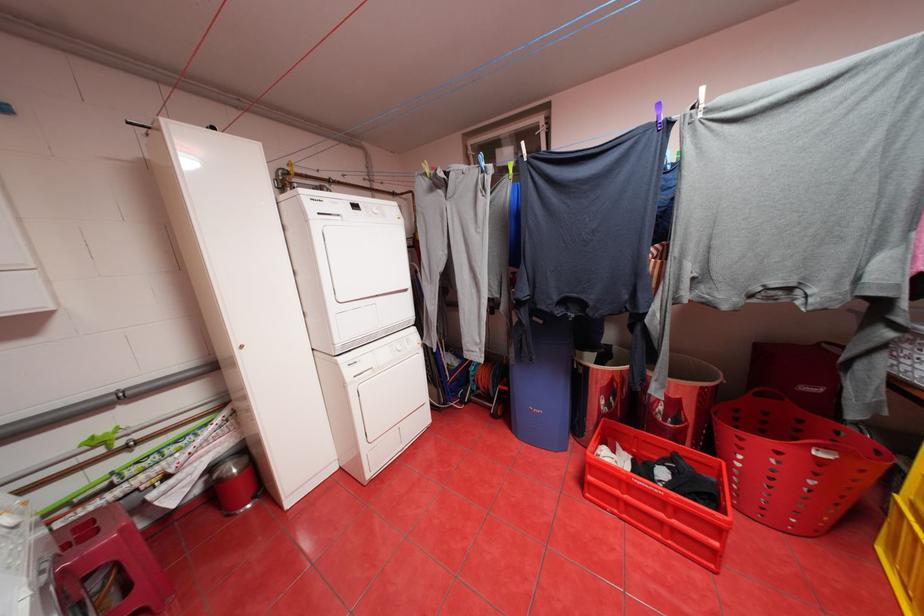
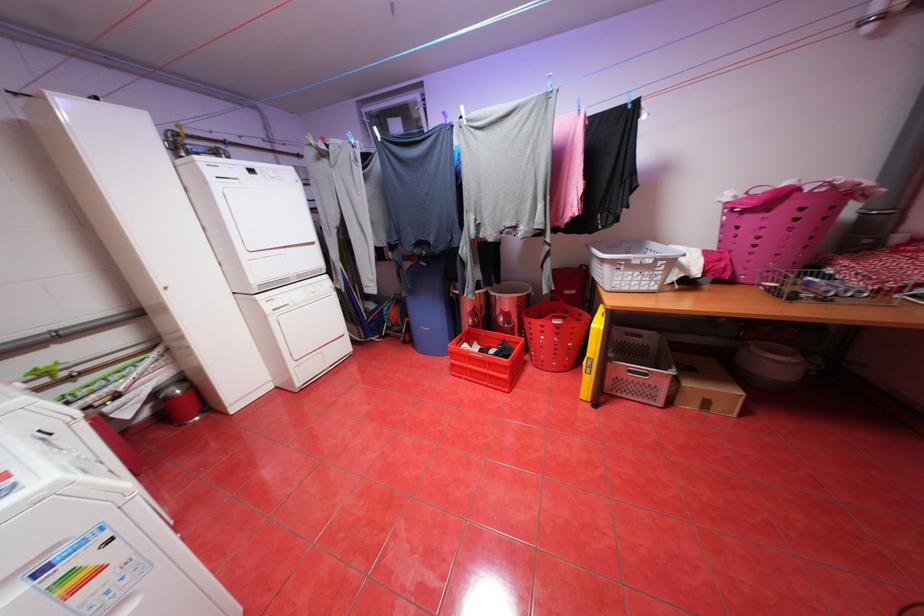
In the second image, find the point that corresponds to the point at 358,373 in the first image.

(275, 307)